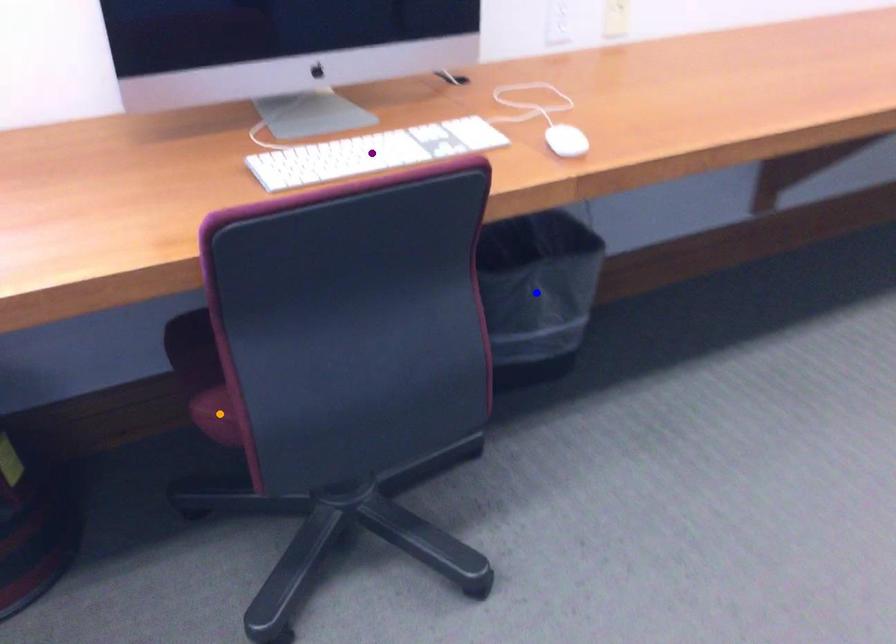
Order these from nearest to farthest:
orange point
blue point
purple point

1. orange point
2. purple point
3. blue point